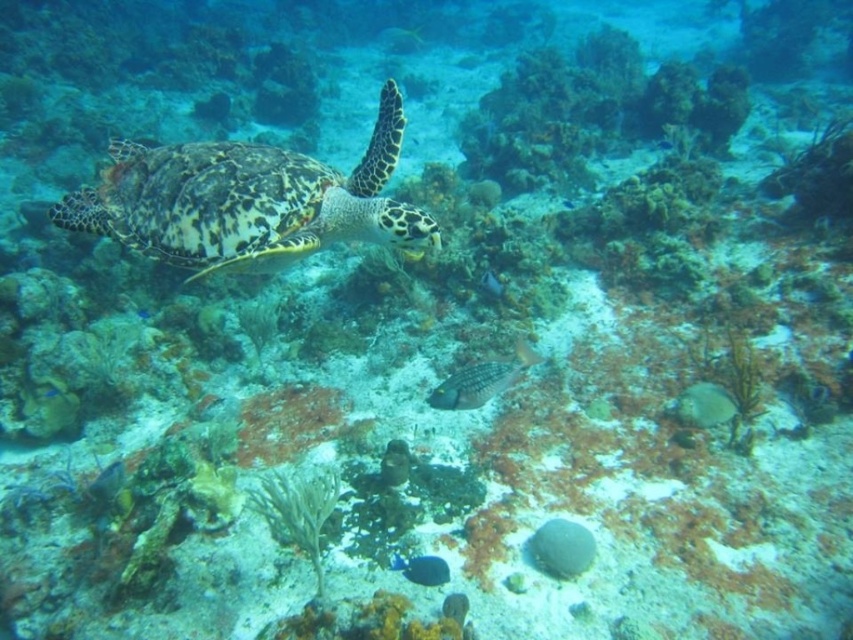
You are a marine biologist observing the underwater scene. You notice the leathery brown turtle at center and the shiny yellow fish at center. Which of these two creatures is located higher in the water column?

The shiny yellow fish at center is higher in the water column because the leathery brown turtle at center is positioned under it.